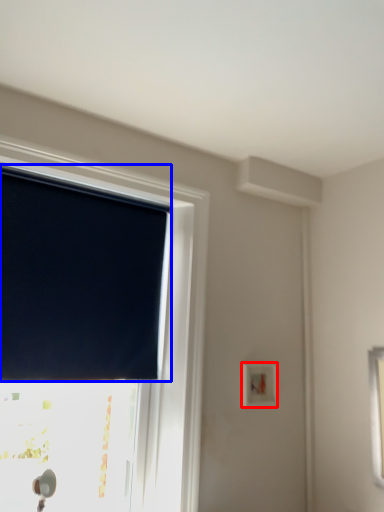
Question: Which point is further to the camera, light switch (highlighted by a red box) or window blind (highlighted by a blue box)?

Choices:
 (A) light switch
 (B) window blind

Answer: (A)